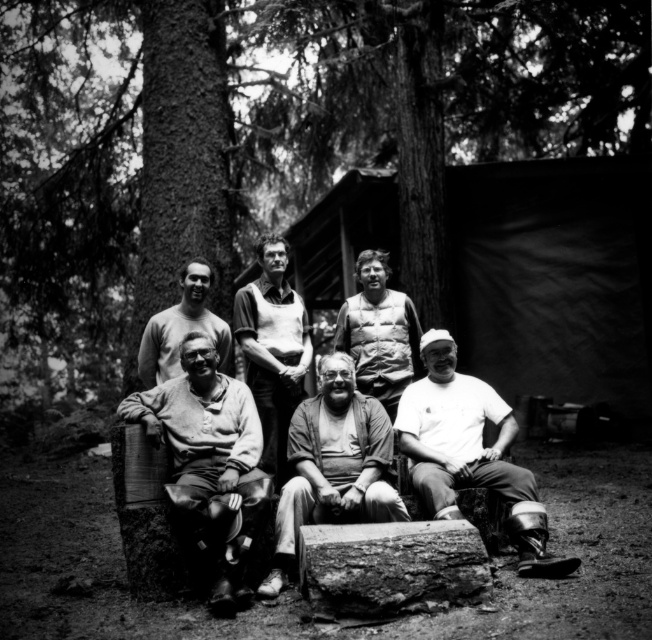
Question: Considering the real-world distances, which object is closest to the smooth gray sweater at center?

Choices:
 (A) smooth white shirt at center
 (B) smooth beige sweater at lower left
 (C) brown rough tree trunk at left
 (D) light gray sweater at center

Answer: (A)

Question: Is white matte shirt at lower right thinner than smooth white shirt at center?

Choices:
 (A) no
 (B) yes

Answer: (A)

Question: Which point is farther to the camera?

Choices:
 (A) (319, 472)
 (B) (156, 132)
 (C) (239, 312)
 (D) (190, 316)

Answer: (B)

Question: Does smooth beige sweater at lower left have a smaller size compared to white matte shirt at lower right?

Choices:
 (A) yes
 (B) no

Answer: (A)

Question: Does smooth beige sweater at lower left lie in front of smooth white shirt at center?

Choices:
 (A) no
 (B) yes

Answer: (B)

Question: Which point appears closest to the camera in this image?

Choices:
 (A) (263, 364)
 (B) (492, 483)
 (C) (156, 124)

Answer: (B)